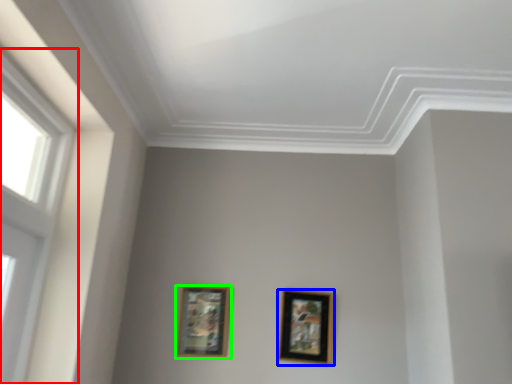
Question: Considering the real-world distances, which object is closest to window (highlighted by a red box)? picture frame (highlighted by a blue box) or picture frame (highlighted by a green box).

Choices:
 (A) picture frame
 (B) picture frame

Answer: (B)